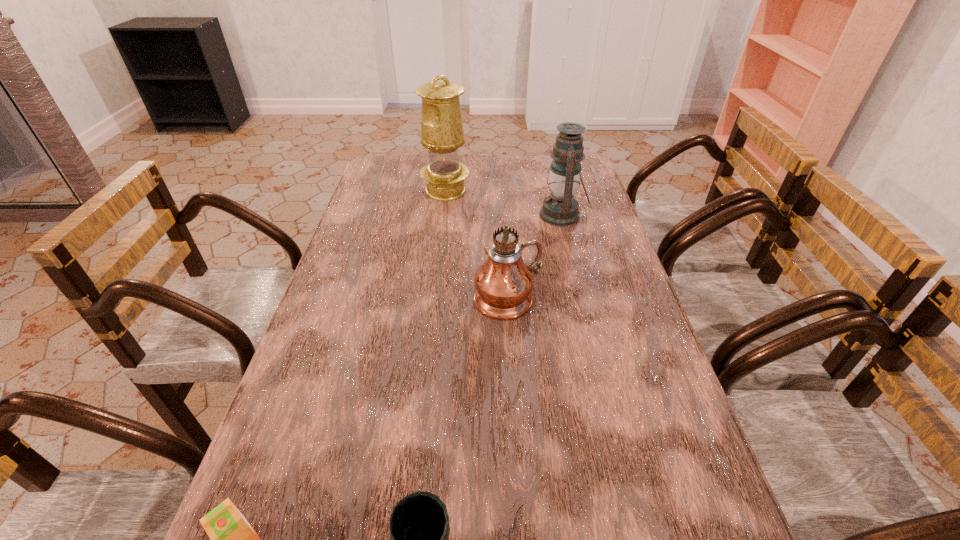
This screenshot has width=960, height=540. In the image, there is a desktop. In order to click on vacant space at the far edge in this screenshot , I will do `click(426, 159)`.

Identify the location of vacant space at the left edge of the desktop. This screenshot has height=540, width=960. (373, 201).

At what (x,y) coordinates should I click in order to perform the action: click on free space at the right edge of the desktop. Please return your answer as a coordinate pair (x, y). Looking at the image, I should click on tap(599, 265).

Identify the location of vacant area that lies between the third nearest object and the leftmost oil lamp. (477, 245).

Find the location of `vacant point located between the nearest oil lamp and the leftmost oil lamp`. vacant point located between the nearest oil lamp and the leftmost oil lamp is located at coordinates (477, 245).

Locate an element on the screen. The width and height of the screenshot is (960, 540). the fourth closest object relative to the leftmost oil lamp is located at coordinates (419, 525).

At what (x,y) coordinates should I click in order to perform the action: click on object that is the third nearest to the shortest object. Please return your answer as a coordinate pair (x, y). Looking at the image, I should click on (560, 208).

Identify which oil lamp is the second closest to the second object from right to left. Please provide its 2D coordinates. Your answer should be formatted as a tuple, i.e. [(x, y)], where the tuple contains the x and y coordinates of a point satisfying the conditions above.

[(442, 133)]

Find the location of a particular element. Image resolution: width=960 pixels, height=540 pixels. the closest oil lamp relative to the rightmost object is located at coordinates (503, 283).

This screenshot has height=540, width=960. I want to click on free space that satisfies the following two spatial constraints: 1. on the front side of the fourth object from left to right; 2. on the right side of the leftmost oil lamp, so click(433, 300).